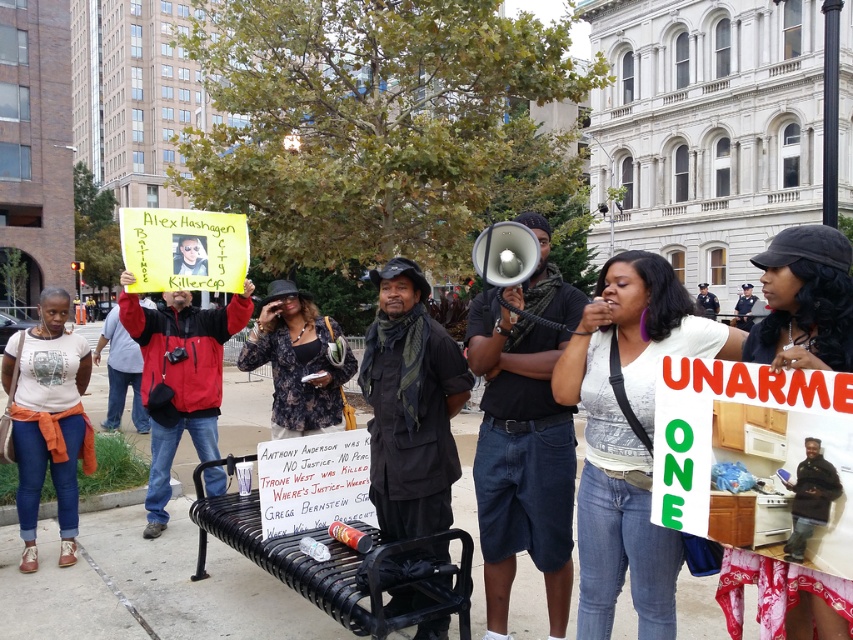
Question: Is black metal bench at center further to camera compared to floral dress at center?

Choices:
 (A) no
 (B) yes

Answer: (A)

Question: Does black fabric hat at upper center have a lesser width compared to matte white t-shirt at center?

Choices:
 (A) no
 (B) yes

Answer: (B)

Question: Which point is closer to the camera?

Choices:
 (A) black metal bench at center
 (B) black fabric hat at upper center

Answer: (B)

Question: Which point is closer to the camera taking this photo?

Choices:
 (A) (73, 417)
 (B) (796, 577)
 (C) (456, 566)
 (D) (566, 348)

Answer: (B)

Question: Among these objects, which one is farthest from the camera?

Choices:
 (A) black fabric hat at upper center
 (B) black metal bench at center
 (C) matte white t-shirt at center

Answer: (C)

Question: Does white cotton shirt at center have a greater width compared to black metal bench at center?

Choices:
 (A) no
 (B) yes

Answer: (A)